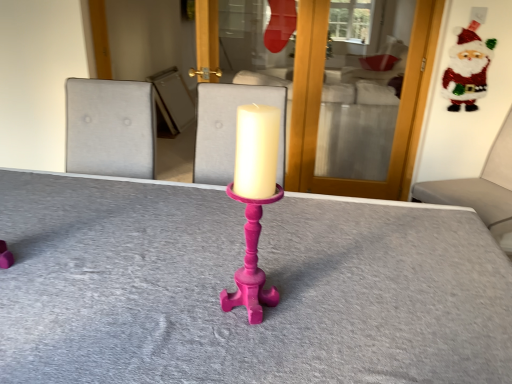
You are a GUI agent. You are given a task and a screenshot of the screen. Output one action in this format:
    pyautogui.click(x=<x>, y=<y>)
    Task: Click on the free space to the left of matte pink candle holder at center
    The image size is (512, 384).
    Given the screenshot: What is the action you would take?
    pyautogui.click(x=170, y=307)